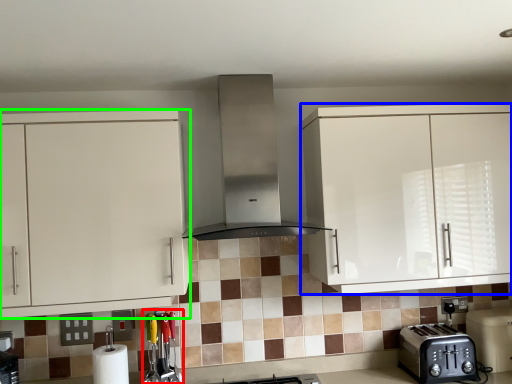
Question: Which object is the farthest from appliance (highlighted by a red box)? Choose among these: cabinetry (highlighted by a blue box) or cabinetry (highlighted by a green box).

Choices:
 (A) cabinetry
 (B) cabinetry

Answer: (A)